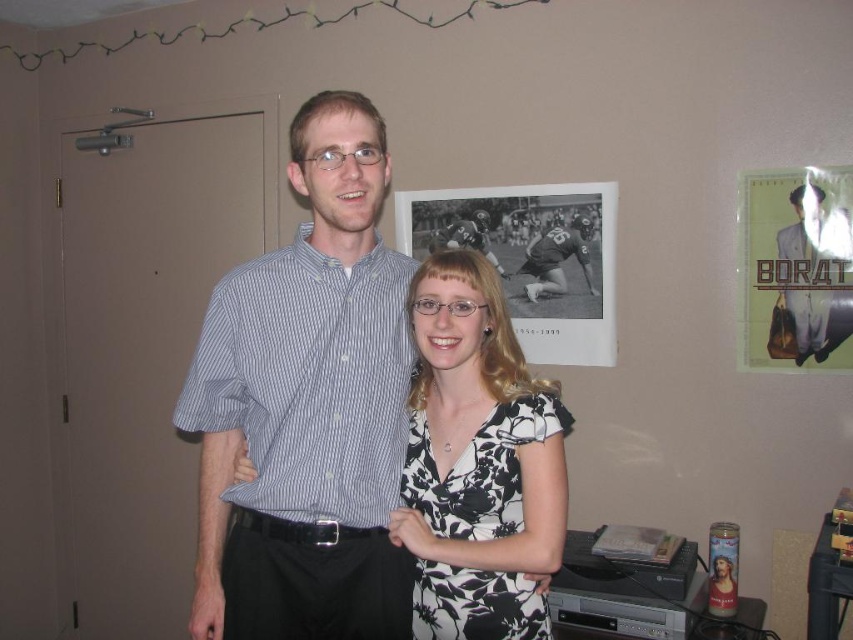
Can you confirm if black floral dress at center is smaller than black leather football player at center?

Actually, black floral dress at center might be larger than black leather football player at center.

Is black floral dress at center to the right of black leather football player at center from the viewer's perspective?

No, black floral dress at center is not to the right of black leather football player at center.

The width and height of the screenshot is (853, 640). Describe the element at coordinates (479, 461) in the screenshot. I see `black floral dress at center` at that location.

Find the location of a particular element. black floral dress at center is located at coordinates (479, 461).

Does striped cotton shirt at center lie in front of black leather football player at center?

Yes, striped cotton shirt at center is in front of black leather football player at center.

Is striped cotton shirt at center below black leather football player at center?

Indeed, striped cotton shirt at center is positioned under black leather football player at center.

Is point (337, 316) positioned before point (543, 266)?

Yes, point (337, 316) is closer to viewer.

In order to click on striped cotton shirt at center in this screenshot , I will do `click(306, 406)`.

Between point (328, 472) and point (804, 332), which one is positioned in front?

Point (328, 472) is more forward.

Who is shorter, striped cotton shirt at center or light brown fabric suit at center?

light brown fabric suit at center

Where is `striped cotton shirt at center`? The width and height of the screenshot is (853, 640). striped cotton shirt at center is located at coordinates (306, 406).